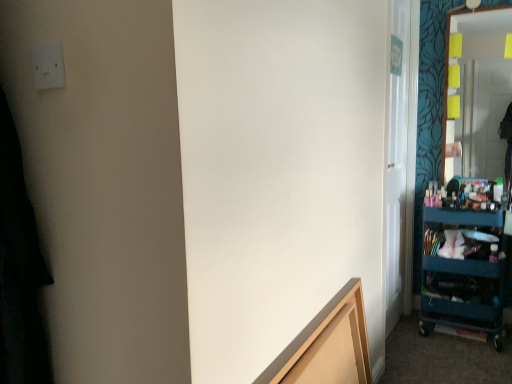
Question: Is teal plastic cart at right closer to camera compared to light brown wood frame at lower center?

Choices:
 (A) yes
 (B) no

Answer: (B)

Question: Can you confirm if teal plastic cart at right is shorter than light brown wood frame at lower center?

Choices:
 (A) yes
 (B) no

Answer: (B)

Question: Does teal plastic cart at right have a smaller size compared to light brown wood frame at lower center?

Choices:
 (A) no
 (B) yes

Answer: (A)

Question: From a real-world perspective, is teal plastic cart at right over light brown wood frame at lower center?

Choices:
 (A) no
 (B) yes

Answer: (A)

Question: Is teal plastic cart at right looking in the opposite direction of light brown wood frame at lower center?

Choices:
 (A) yes
 (B) no

Answer: (B)

Question: In terms of size, does matte glass mirror at right appear bigger or smaller than white plastic electric outlet at upper left?

Choices:
 (A) small
 (B) big

Answer: (B)

Question: In terms of height, does matte glass mirror at right look taller or shorter compared to white plastic electric outlet at upper left?

Choices:
 (A) short
 (B) tall

Answer: (B)

Question: Based on their positions, is matte glass mirror at right located to the left or right of white plastic electric outlet at upper left?

Choices:
 (A) left
 (B) right

Answer: (B)

Question: Is matte glass mirror at right wider or thinner than white plastic electric outlet at upper left?

Choices:
 (A) thin
 (B) wide

Answer: (B)

Question: From a real-world perspective, is light brown wood frame at lower center above or below white plastic electric outlet at upper left?

Choices:
 (A) below
 (B) above

Answer: (A)

Question: Is light brown wood frame at lower center wider or thinner than white plastic electric outlet at upper left?

Choices:
 (A) thin
 (B) wide

Answer: (B)

Question: Which is correct: light brown wood frame at lower center is inside white plastic electric outlet at upper left, or outside of it?

Choices:
 (A) inside
 (B) outside

Answer: (B)

Question: In terms of height, does light brown wood frame at lower center look taller or shorter compared to white plastic electric outlet at upper left?

Choices:
 (A) tall
 (B) short

Answer: (A)

Question: Is point (362, 370) closer or farther from the camera than point (414, 145)?

Choices:
 (A) farther
 (B) closer

Answer: (B)

Question: From a real-world perspective, is light brown wood frame at lower center positioned above or below transparent glass door at right?

Choices:
 (A) above
 (B) below

Answer: (B)